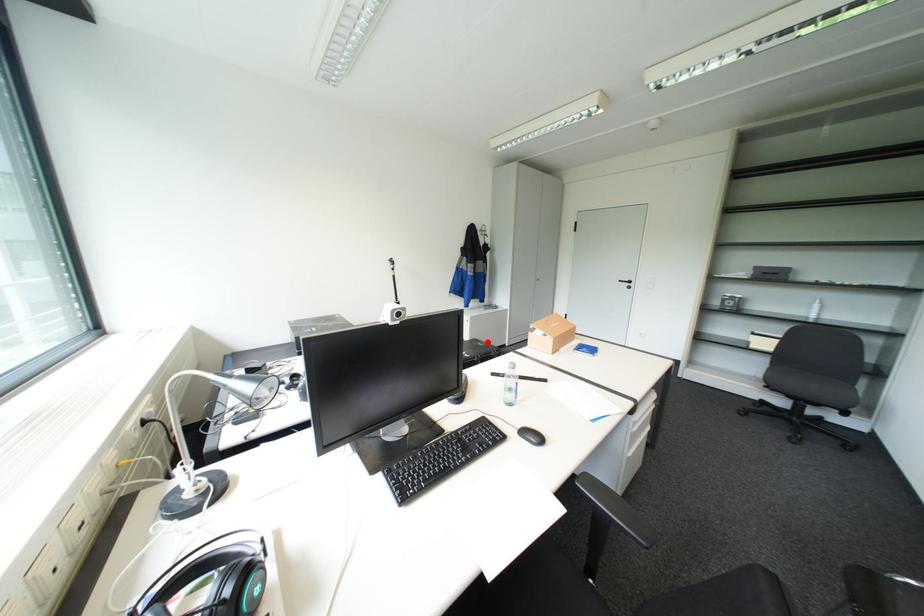
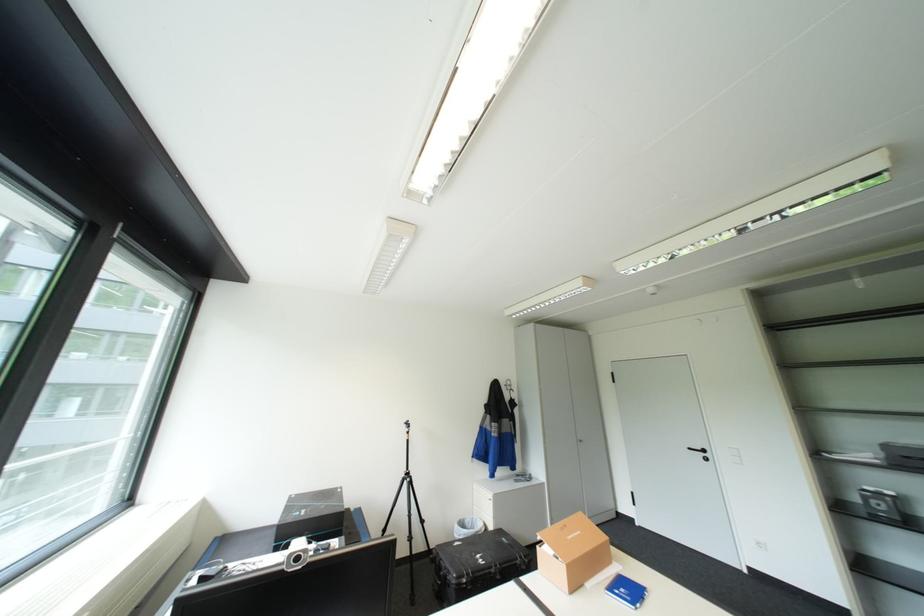
The point at the highlighted location is marked in the first image. Where is the corresponding point in the second image?

(513, 538)